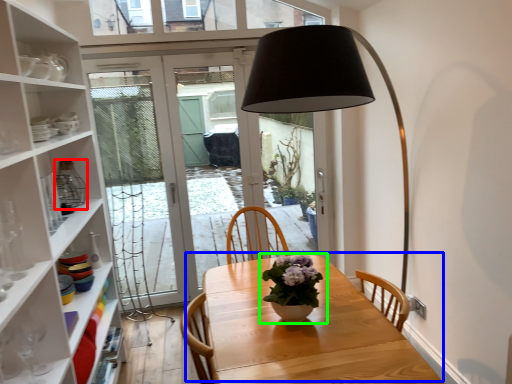
Question: Which object is the closest to the glass vase (highlighted by a red box)? Choose among these: table (highlighted by a blue box) or houseplant (highlighted by a green box).

Choices:
 (A) table
 (B) houseplant

Answer: (A)